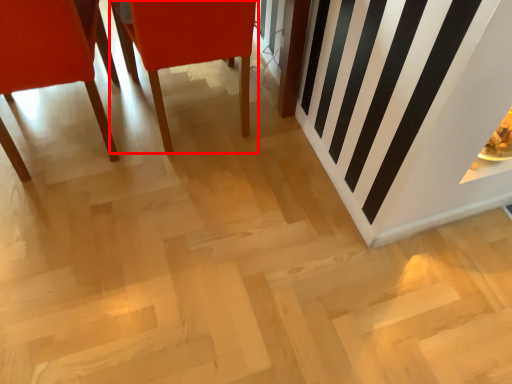
Question: Where is chair (annotated by the red box) located in relation to chair in the image?

Choices:
 (A) right
 (B) left

Answer: (A)